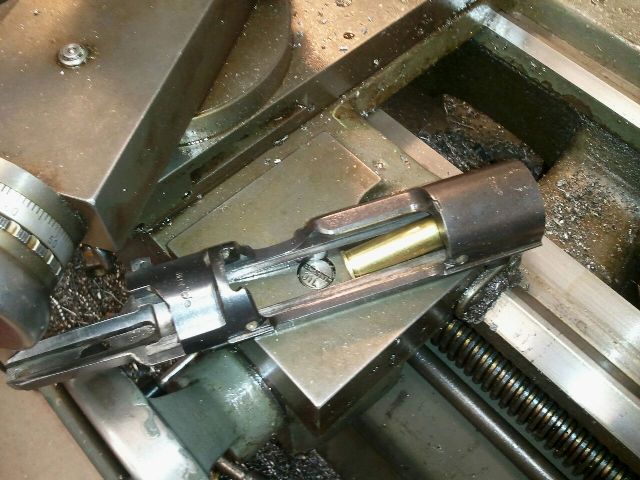
The height and width of the screenshot is (480, 640). Identify the location of rod. (506, 433).